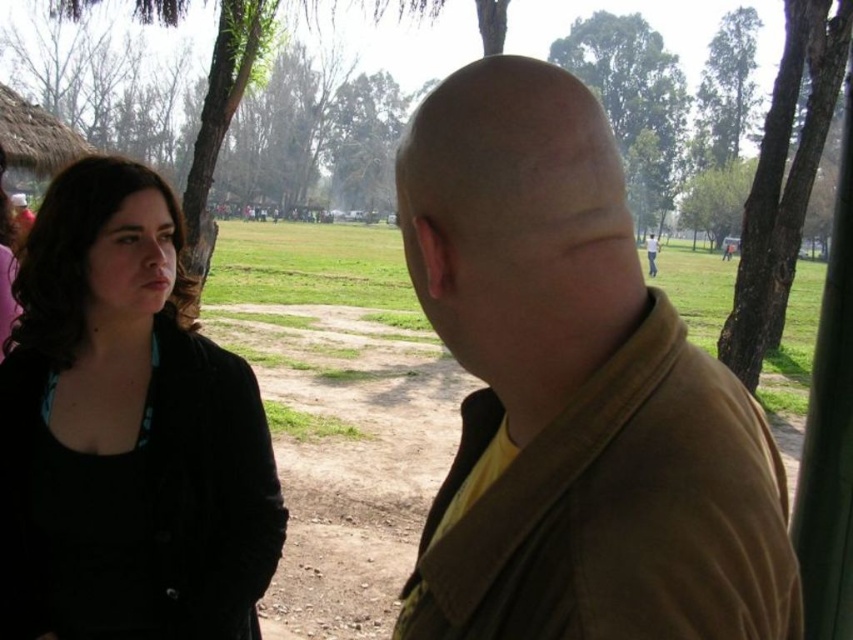
You are standing in the park and see both the brown matte jacket at center and the black matte jacket at left. Which jacket is nearer to you?

The brown matte jacket at center is closer to the viewer than the black matte jacket at left, so the brown matte jacket at center is nearer to you.

You are a photographer trying to capture a photo of both the brown matte jacket at center and the black matte jacket at left in the same frame. The minimum distance between the jackets required for your camera to focus on both is 4 feet. Can you capture both jackets in focus without moving either?

The brown matte jacket at center and the black matte jacket at left are 3.83 feet apart, which is less than the 4 feet required for the camera to focus on both. Therefore, you cannot capture both jackets in focus without moving them.